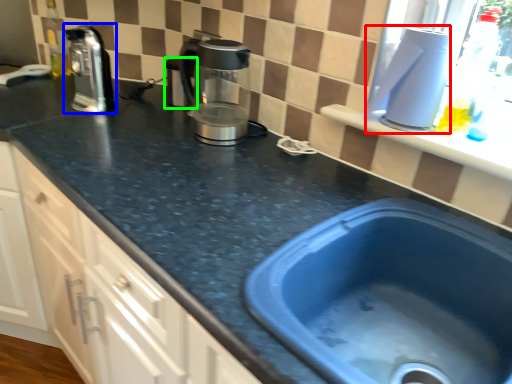
Question: Which object is positioned closest to appliance (highlighted by a red box)? Select from coffeepot (highlighted by a blue box) and appliance (highlighted by a green box).

Choices:
 (A) coffeepot
 (B) appliance

Answer: (B)